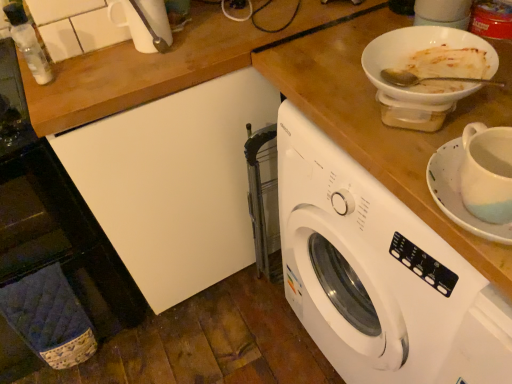
Question: Is white ceramic saucer at right at the right side of white plastic washing machine at center?

Choices:
 (A) yes
 (B) no

Answer: (B)

Question: Considering the relative positions of white ceramic saucer at right and white plastic washing machine at center in the image provided, is white ceramic saucer at right in front of white plastic washing machine at center?

Choices:
 (A) no
 (B) yes

Answer: (B)

Question: Is white ceramic saucer at right positioned behind white plastic washing machine at center?

Choices:
 (A) no
 (B) yes

Answer: (A)

Question: Can you confirm if white ceramic saucer at right is shorter than white plastic washing machine at center?

Choices:
 (A) yes
 (B) no

Answer: (A)

Question: From a real-world perspective, is white ceramic saucer at right positioned under white plastic washing machine at center based on gravity?

Choices:
 (A) yes
 (B) no

Answer: (B)

Question: In terms of width, does white plastic washing machine at center look wider or thinner when compared to transparent plastic bottle at upper left?

Choices:
 (A) thin
 (B) wide

Answer: (B)

Question: In terms of size, does white plastic washing machine at center appear bigger or smaller than transparent plastic bottle at upper left?

Choices:
 (A) small
 (B) big

Answer: (B)

Question: Choose the correct answer: Is white plastic washing machine at center inside transparent plastic bottle at upper left or outside it?

Choices:
 (A) outside
 (B) inside

Answer: (A)

Question: From a real-world perspective, relative to transparent plastic bottle at upper left, is white plastic washing machine at center vertically above or below?

Choices:
 (A) below
 (B) above

Answer: (A)

Question: Does point (345, 236) appear closer or farther from the camera than point (404, 96)?

Choices:
 (A) farther
 (B) closer

Answer: (A)

Question: Visually, is white plastic washing machine at center positioned to the left or to the right of white glossy bowl at upper right?

Choices:
 (A) left
 (B) right

Answer: (B)

Question: In the image, is white plastic washing machine at center positioned in front of or behind white glossy bowl at upper right?

Choices:
 (A) behind
 (B) front

Answer: (B)

Question: Considering the positions of white plastic washing machine at center and white glossy bowl at upper right in the image, is white plastic washing machine at center taller or shorter than white glossy bowl at upper right?

Choices:
 (A) short
 (B) tall

Answer: (B)

Question: Is point (448, 188) positioned closer to the camera than point (443, 342)?

Choices:
 (A) farther
 (B) closer

Answer: (B)

Question: Considering the positions of white ceramic saucer at right and white plastic washing machine at center in the image, is white ceramic saucer at right bigger or smaller than white plastic washing machine at center?

Choices:
 (A) big
 (B) small

Answer: (B)